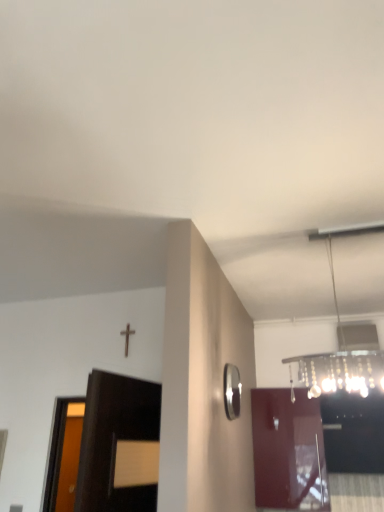
What is the approximate width of polished silver mirror at right?

It is 5.09 centimeters.

This screenshot has height=512, width=384. Identify the location of polished silver mirror at right. (232, 391).

How many degrees apart are the facing directions of polished silver mirror at right and glossy wood door at center?

The facing directions of polished silver mirror at right and glossy wood door at center are 92 degrees apart.

Identify the location of door that is below the polished silver mirror at right (from the image's perspective). This screenshot has width=384, height=512. (288, 451).

Does polished silver mirror at right touch glossy wood door at center?

No, polished silver mirror at right is not in contact with glossy wood door at center.

Is clear glass chandelier at upper right aimed at polished silver mirror at right?

No.

From a real-world perspective, is clear glass chandelier at upper right physically located above or below polished silver mirror at right?

clear glass chandelier at upper right is situated higher than polished silver mirror at right in the real world.

Would you say clear glass chandelier at upper right is a long distance from polished silver mirror at right?

No.

The height and width of the screenshot is (512, 384). I want to click on light fixture in front of the polished silver mirror at right, so click(342, 354).

Identify the location of light fixture that appears in front of the glossy wood door at center. click(x=342, y=354).

Who is taller, glossy wood door at center or clear glass chandelier at upper right?

clear glass chandelier at upper right.

Does glossy wood door at center turn towards clear glass chandelier at upper right?

Yes, glossy wood door at center is oriented towards clear glass chandelier at upper right.

Is polished silver mirror at right far away from clear glass chandelier at upper right?

No, polished silver mirror at right is not far from clear glass chandelier at upper right.

Is polished silver mirror at right to the left of clear glass chandelier at upper right from the viewer's perspective?

Yes, polished silver mirror at right is to the left of clear glass chandelier at upper right.

Is polished silver mirror at right turned away from clear glass chandelier at upper right?

No, polished silver mirror at right is not facing away from clear glass chandelier at upper right.

From a real-world perspective, does clear glass chandelier at upper right stand above glossy wood door at center?

Yes, from a real-world perspective, clear glass chandelier at upper right is above glossy wood door at center.

Which is more to the left, clear glass chandelier at upper right or glossy wood door at center?

From the viewer's perspective, clear glass chandelier at upper right appears more on the left side.

How different are the orientations of clear glass chandelier at upper right and glossy wood door at center in degrees?

They differ by 1.47 degrees in their facing directions.

From the image's perspective, is clear glass chandelier at upper right below glossy wood door at center?

No.

Considering the sizes of objects glossy wood door at center and polished silver mirror at right in the image provided, who is thinner, glossy wood door at center or polished silver mirror at right?

With smaller width is polished silver mirror at right.

From the image's perspective, between glossy wood door at center and polished silver mirror at right, which one is located above?

polished silver mirror at right appears higher in the image.

Considering the points (312, 464) and (231, 400), which point is behind, point (312, 464) or point (231, 400)?

The point (312, 464) is farther from the camera.

Can you confirm if glossy wood door at center is shorter than polished silver mirror at right?

In fact, glossy wood door at center may be taller than polished silver mirror at right.

Image resolution: width=384 pixels, height=512 pixels. I want to click on door below the polished silver mirror at right (from the image's perspective), so click(288, 451).

The height and width of the screenshot is (512, 384). I want to click on mirror that appears behind the clear glass chandelier at upper right, so click(232, 391).

When comparing their distances from glossy wood door at center, does polished silver mirror at right or clear glass chandelier at upper right seem further?

The object further to glossy wood door at center is polished silver mirror at right.

When comparing their distances from clear glass chandelier at upper right, does polished silver mirror at right or glossy wood door at center seem closer?

glossy wood door at center is closer to clear glass chandelier at upper right.

Which object lies further to the anchor point polished silver mirror at right, clear glass chandelier at upper right or glossy wood door at center?

glossy wood door at center.

Estimate the real-world distances between objects in this image. Which object is further from clear glass chandelier at upper right, glossy wood door at center or polished silver mirror at right?

Among the two, polished silver mirror at right is located further to clear glass chandelier at upper right.

Estimate the real-world distances between objects in this image. Which object is further from glossy wood door at center, clear glass chandelier at upper right or polished silver mirror at right?

The object further to glossy wood door at center is polished silver mirror at right.

Based on their spatial positions, is glossy wood door at center or clear glass chandelier at upper right closer to polished silver mirror at right?

The object closer to polished silver mirror at right is clear glass chandelier at upper right.

Find the location of a particular element. Image resolution: width=384 pixels, height=512 pixels. mirror positioned between clear glass chandelier at upper right and glossy wood door at center from near to far is located at coordinates (232, 391).